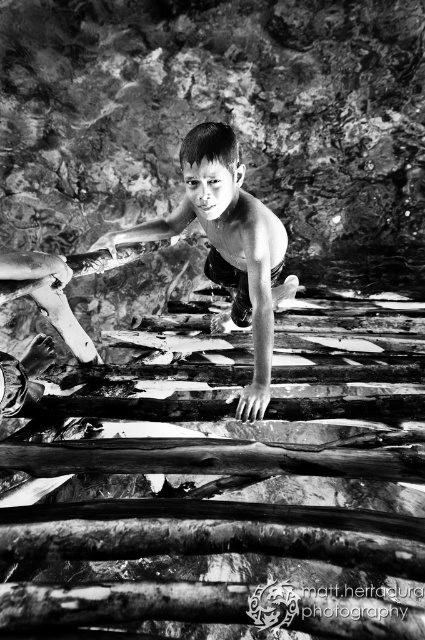
Question: Which point is closer to the camera taking this photo?

Choices:
 (A) (223, 138)
 (B) (336, 486)

Answer: (A)

Question: Does rough wooden plank at center appear under smooth skin child at center?

Choices:
 (A) no
 (B) yes

Answer: (B)

Question: Is the position of rough wooden plank at center more distant than that of smooth skin child at center?

Choices:
 (A) no
 (B) yes

Answer: (A)

Question: Which of the following is the farthest from the observer?

Choices:
 (A) rough wooden plank at center
 (B) smooth skin child at center

Answer: (B)

Question: Where is rough wooden plank at center located in relation to smooth skin child at center in the image?

Choices:
 (A) below
 (B) above

Answer: (A)